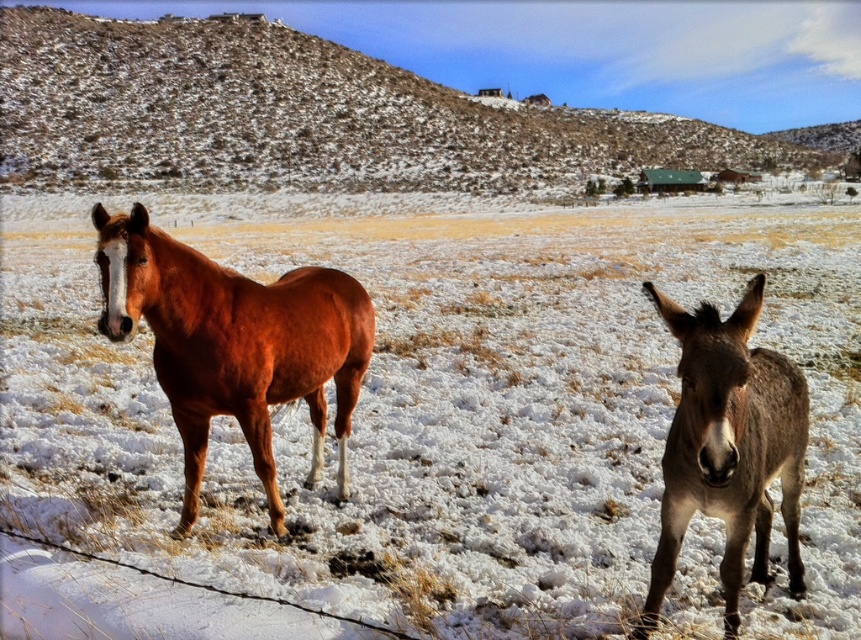
Question: Can you confirm if brown glossy horse at left is positioned to the right of gray rough fur donkey at right?

Choices:
 (A) yes
 (B) no

Answer: (B)

Question: Among these points, which one is farthest from the camera?

Choices:
 (A) (796, 488)
 (B) (215, 348)

Answer: (A)

Question: Which of the following is the farthest from the observer?

Choices:
 (A) gray rough fur donkey at right
 (B) brown glossy horse at left

Answer: (B)

Question: Observing the image, what is the correct spatial positioning of brown glossy horse at left in reference to gray rough fur donkey at right?

Choices:
 (A) above
 (B) below

Answer: (A)

Question: Is brown glossy horse at left thinner than gray rough fur donkey at right?

Choices:
 (A) yes
 (B) no

Answer: (B)